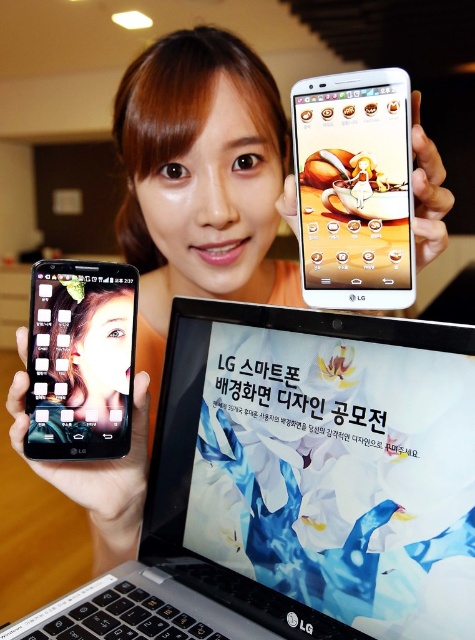
You are a graphic designer who needs to place a new sticker on the white glossy tablet at upper center. According to the coordinates provided, where exactly should you position the sticker?

The sticker should be placed at the coordinates point (354, 189) on the white glossy tablet at upper center as specified.

You are a photographer setting up a tripod to take a product photo of the white glossy tablet at upper center. The camera on the tripod is currently 18 inches away from the tablet. Should you move the camera closer or farther away to match the recommended distance of 17.15 inches?

The white glossy tablet at upper center is 17.15 inches from camera. Since the camera is currently 18 inches away, you should move it closer by 0.85 inches to reach the recommended distance.

You are standing in front of the scene described. You want to place a 40 cm wide decorative mat under the black plastic laptop at center. Will the mat be large enough to fully cover the laptop?

The distance between the black plastic laptop at center and the viewer is 39.78 centimeters. However, the question is about the width of the laptop, not the distance. Since the laptop width isn t provided, we can t determine if the mat will fit. Please check the laptop s actual width.